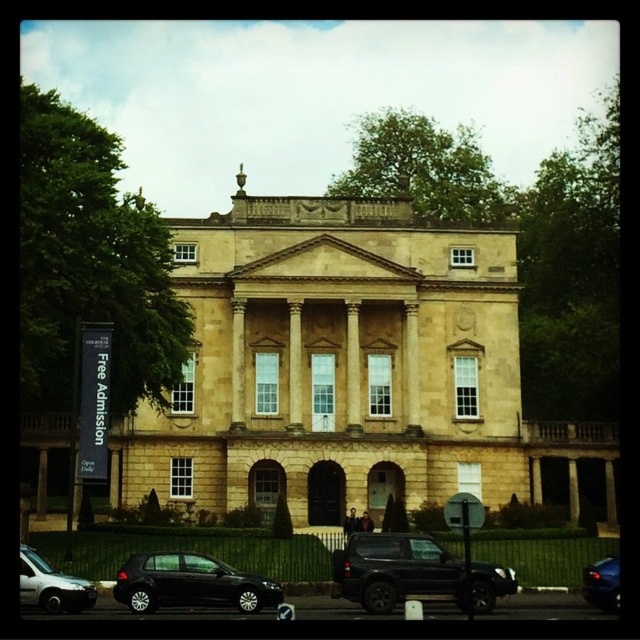
Question: Among these objects, which one is nearest to the camera?

Choices:
 (A) shiny black car at lower left
 (B) black matte suv at center
 (C) shiny blue sedan at lower right
 (D) silver metallic hatchback at lower left

Answer: (B)

Question: Is shiny black car at lower left thinner than silver metallic hatchback at lower left?

Choices:
 (A) no
 (B) yes

Answer: (A)

Question: Which point is closer to the camera?

Choices:
 (A) silver metallic hatchback at lower left
 (B) shiny blue sedan at lower right

Answer: (A)

Question: Does black matte suv at center appear on the right side of shiny blue sedan at lower right?

Choices:
 (A) no
 (B) yes

Answer: (A)

Question: Among these objects, which one is nearest to the camera?

Choices:
 (A) shiny black car at lower left
 (B) silver metallic hatchback at lower left
 (C) black matte suv at center

Answer: (C)

Question: Does silver metallic hatchback at lower left appear on the right side of shiny blue sedan at lower right?

Choices:
 (A) no
 (B) yes

Answer: (A)